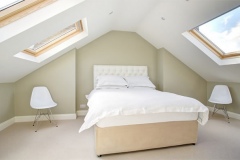
Find the location of `bed`. bed is located at coordinates (165, 130).